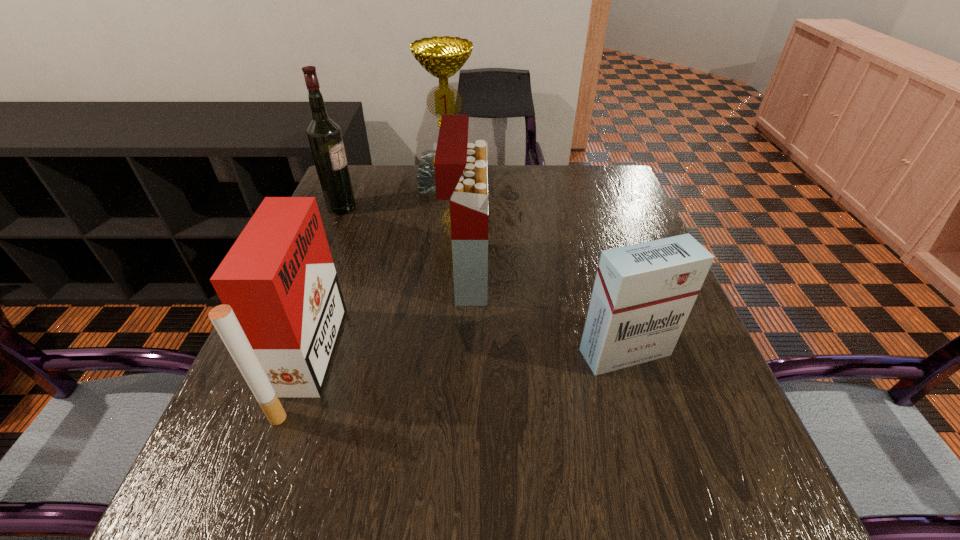
The height and width of the screenshot is (540, 960). In order to click on the farthest object in this screenshot , I will do `click(442, 57)`.

What are the coordinates of `the fourth nearest object` in the screenshot? It's located at (324, 135).

This screenshot has height=540, width=960. I want to click on the tallest cigarette case, so click(460, 166).

At what (x,y) coordinates should I click in order to perform the action: click on the second cigarette case from left to right. Please return your answer as a coordinate pair (x, y). Image resolution: width=960 pixels, height=540 pixels. Looking at the image, I should click on (460, 166).

You are a GUI agent. You are given a task and a screenshot of the screen. Output one action in this format:
    pyautogui.click(x=<x>, y=<y>)
    Task: Click on the leftmost cigarette case
    
    Given the screenshot: What is the action you would take?
    pyautogui.click(x=282, y=311)

Find the location of a particular element. the rightmost object is located at coordinates coord(643,293).

The width and height of the screenshot is (960, 540). What are the coordinates of `free spot located on the front-facing side of the award` in the screenshot? It's located at (438, 280).

This screenshot has height=540, width=960. What are the coordinates of `free space located 0.110m on the front and back of the wine bottle` in the screenshot? It's located at (396, 207).

At what (x,y) coordinates should I click in order to perform the action: click on vacant space located 0.160m with the lid open on the third nearest object. Please return your answer as a coordinate pair (x, y). Looking at the image, I should click on (555, 274).

Image resolution: width=960 pixels, height=540 pixels. I want to click on vacant point located on the front-facing side of the leftmost cigarette case, so click(436, 361).